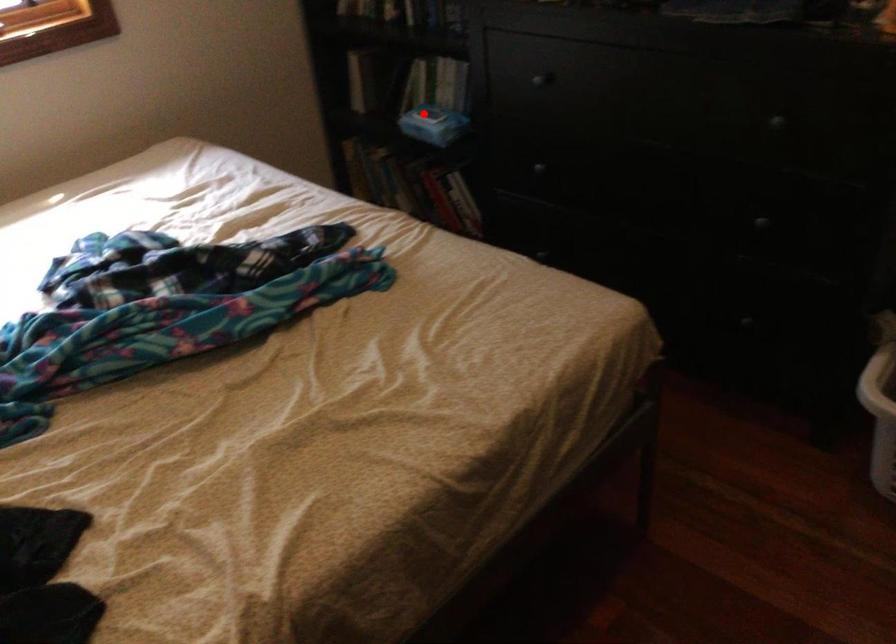
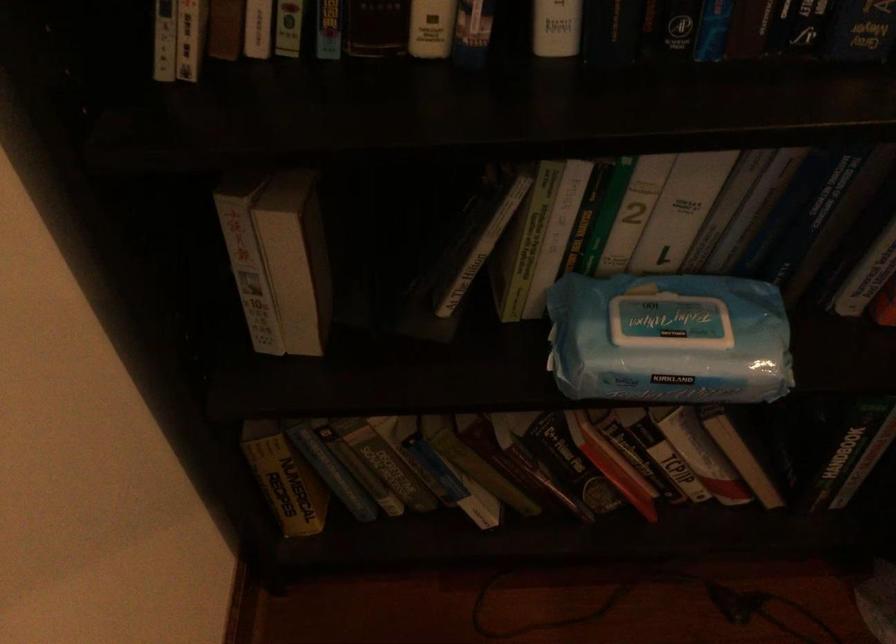
In the second image, find the point that corresponds to the highlighted location in the first image.

(668, 339)